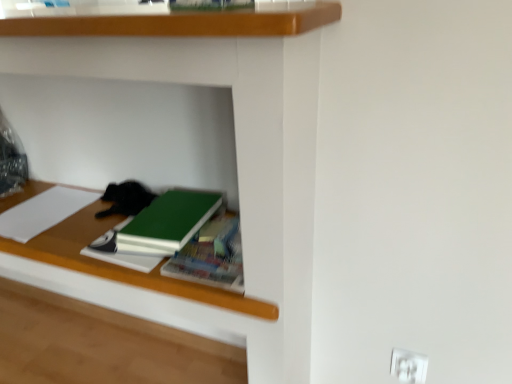
Question: Is green matte notebook at center smaller than black fur cat at center?

Choices:
 (A) yes
 (B) no

Answer: (A)

Question: Is green matte notebook at center oriented towards black fur cat at center?

Choices:
 (A) no
 (B) yes

Answer: (A)

Question: Does green matte notebook at center have a lesser height compared to black fur cat at center?

Choices:
 (A) no
 (B) yes

Answer: (B)

Question: Is green matte notebook at center wider than black fur cat at center?

Choices:
 (A) yes
 (B) no

Answer: (A)

Question: Would you say green matte notebook at center is a long distance from black fur cat at center?

Choices:
 (A) no
 (B) yes

Answer: (A)

Question: From a real-world perspective, is green matte notebook at center physically located above or below green matte book at center, placed as the third book when sorted from left to right?

Choices:
 (A) below
 (B) above

Answer: (A)

Question: From the image's perspective, is green matte notebook at center positioned above or below green matte book at center, placed as the third book when sorted from left to right?

Choices:
 (A) above
 (B) below

Answer: (A)

Question: Is green matte notebook at center in front of or behind green matte book at center, placed as the third book when sorted from left to right, in the image?

Choices:
 (A) front
 (B) behind

Answer: (B)

Question: Based on their positions, is green matte notebook at center located to the left or right of green matte book at center, which is the first book from right to left?

Choices:
 (A) left
 (B) right

Answer: (A)

Question: Would you say green matte book at center, placed as the third book when sorted from left to right, is inside or outside white plastic electric outlet at lower right?

Choices:
 (A) outside
 (B) inside

Answer: (A)

Question: Looking at their shapes, would you say green matte book at center, which is the first book from right to left, is wider or thinner than white plastic electric outlet at lower right?

Choices:
 (A) thin
 (B) wide

Answer: (B)

Question: Is green matte book at center, which is the first book from right to left, in front of or behind white plastic electric outlet at lower right in the image?

Choices:
 (A) front
 (B) behind

Answer: (A)

Question: Does point (238, 249) appear closer or farther from the camera than point (392, 374)?

Choices:
 (A) closer
 (B) farther

Answer: (A)

Question: Is point (130, 192) closer or farther from the camera than point (13, 206)?

Choices:
 (A) closer
 (B) farther

Answer: (A)

Question: Based on their sizes in the image, would you say black fur cat at center is bigger or smaller than white paper at left, the third book positioned from the right?

Choices:
 (A) big
 (B) small

Answer: (A)